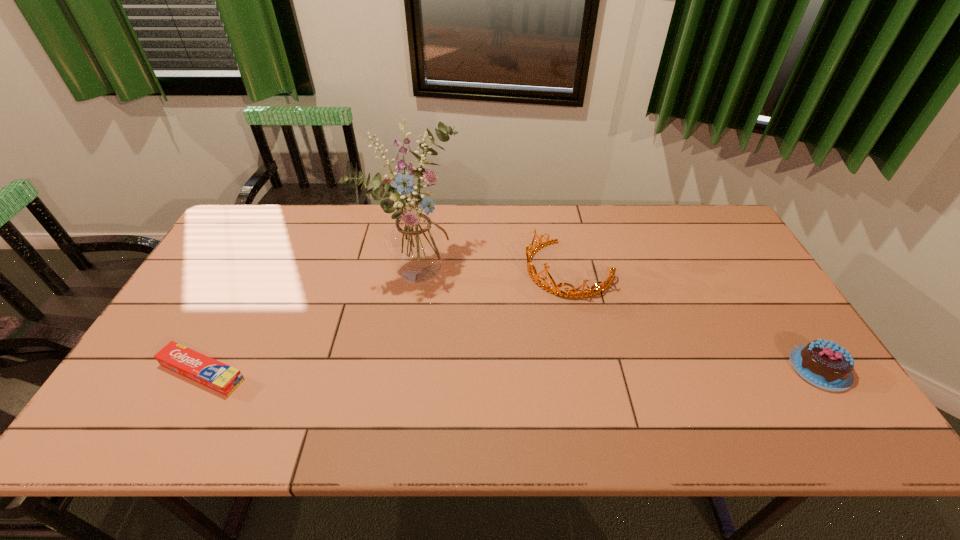
Find the location of a particular element. blank space located on the front-facing side of the tiara is located at coordinates (522, 309).

You are a GUI agent. You are given a task and a screenshot of the screen. Output one action in this format:
    pyautogui.click(x=<x>, y=<y>)
    Task: Click on the free space located on the front-facing side of the tiara
    This screenshot has width=960, height=540.
    Given the screenshot: What is the action you would take?
    pyautogui.click(x=482, y=346)

You are a GUI agent. You are given a task and a screenshot of the screen. Output one action in this format:
    pyautogui.click(x=<x>, y=<y>)
    Task: Click on the free space located on the front-facing side of the tiara
    The width and height of the screenshot is (960, 540).
    Given the screenshot: What is the action you would take?
    pyautogui.click(x=502, y=328)

Image resolution: width=960 pixels, height=540 pixels. I want to click on blank space located on the front-facing side of the third object from right to left, so click(538, 336).

Locate an element on the screen. vacant space located 0.200m on the front-facing side of the third object from right to left is located at coordinates (x=507, y=318).

Where is `vacant area situated on the front-facing side of the third object from right to left`? vacant area situated on the front-facing side of the third object from right to left is located at coordinates (489, 308).

Locate an element on the screen. tiara that is at the far edge is located at coordinates pos(531,268).

At what (x,y) coordinates should I click in order to perform the action: click on bouquet that is at the far edge. Please return your answer as a coordinate pair (x, y). Image resolution: width=960 pixels, height=540 pixels. Looking at the image, I should click on (415, 244).

Locate an element on the screen. Image resolution: width=960 pixels, height=540 pixels. toothpaste that is positioned at the near edge is located at coordinates (198, 367).

The height and width of the screenshot is (540, 960). In order to click on chocolate cake that is at the near edge in this screenshot , I will do `click(824, 364)`.